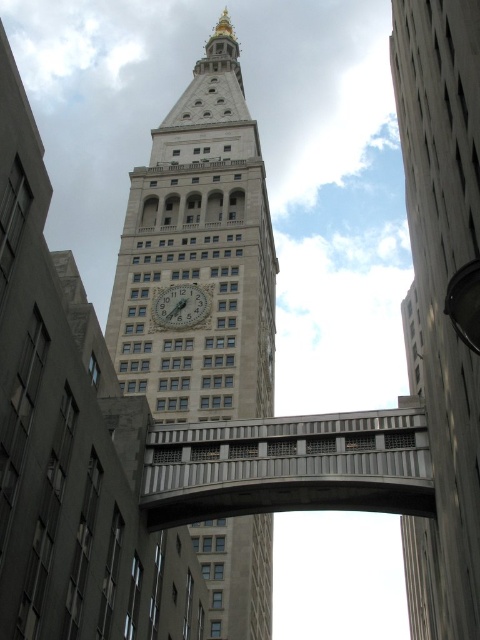
Who is more distant from viewer, (x=411, y=243) or (x=183, y=298)?

Positioned behind is point (x=411, y=243).

Is gray concrete tower at center bigger than gold metallic clock at center?

Yes.

The height and width of the screenshot is (640, 480). What do you see at coordinates (441, 298) in the screenshot? I see `gray concrete tower at center` at bounding box center [441, 298].

Where is `gray concrete tower at center`? gray concrete tower at center is located at coordinates (441, 298).

Find the location of a particular element. beige stone clock tower at center is located at coordinates (200, 253).

Is beige stone clock tower at center further to camera compared to gold metallic clock at center?

No, beige stone clock tower at center is in front of gold metallic clock at center.

Find the location of a particular element. The height and width of the screenshot is (640, 480). beige stone clock tower at center is located at coordinates (200, 253).

Between beige stone clock tower at center and concrete bridge at center, which one is positioned lower?

concrete bridge at center

At what (x,y) coordinates should I click in order to perform the action: click on beige stone clock tower at center. Please return your answer as a coordinate pair (x, y). This screenshot has height=640, width=480. Looking at the image, I should click on (200, 253).